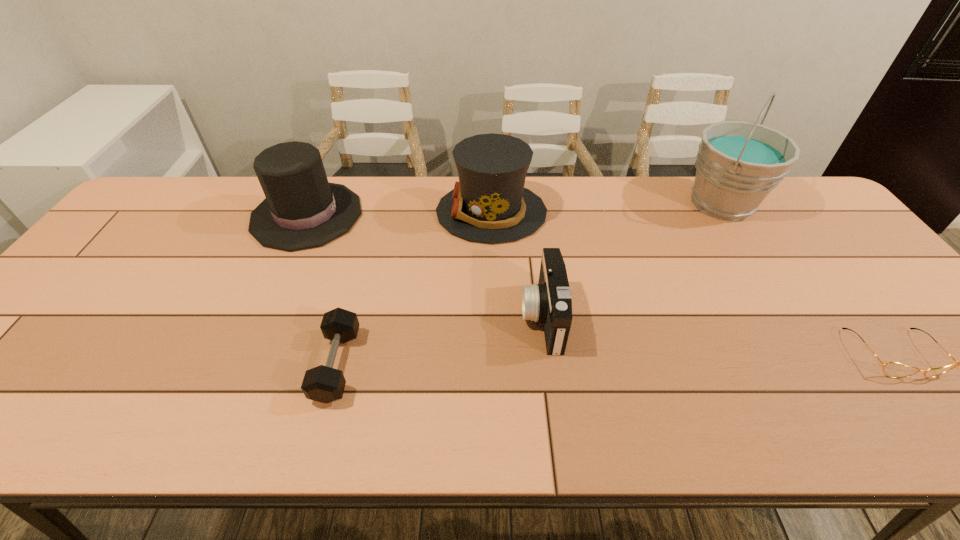
Image resolution: width=960 pixels, height=540 pixels. I want to click on vacant region between the leftmost object and the right dress hat, so click(399, 214).

Locate an element on the screen. empty space between the camcorder and the spectacles is located at coordinates (718, 335).

The width and height of the screenshot is (960, 540). Find the location of `vacant region between the tallest object and the spectacles`. vacant region between the tallest object and the spectacles is located at coordinates (807, 279).

What are the coordinates of `empty space between the fifth tallest object and the right dress hat` in the screenshot? It's located at (414, 288).

Where is `vacant area that lies between the right dress hat and the second object from left to right`? The width and height of the screenshot is (960, 540). vacant area that lies between the right dress hat and the second object from left to right is located at coordinates (414, 288).

This screenshot has height=540, width=960. What are the coordinates of `free space between the leftmost object and the dumbbell` in the screenshot? It's located at (322, 290).

I want to click on object that is the fifth nearest to the camcorder, so coord(891,369).

Identify the location of object that stands as the fourth closest to the shortest object. (325, 384).

Where is `free space that satisfies the following two spatial constraints: 1. on the front of the leftmost object with the decoration; 2. on the left side of the fifth tallest object`? free space that satisfies the following two spatial constraints: 1. on the front of the leftmost object with the decoration; 2. on the left side of the fifth tallest object is located at coordinates (242, 364).